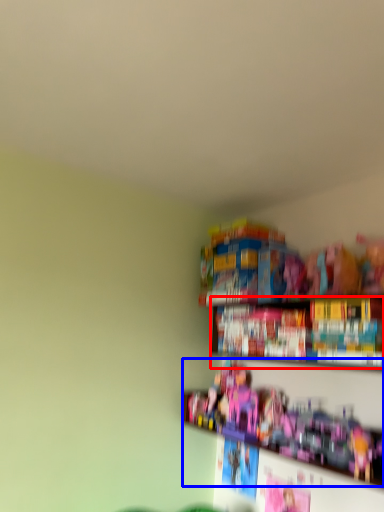
Question: Which point is further to the camera, book (highlighted by a red box) or toy (highlighted by a blue box)?

Choices:
 (A) book
 (B) toy

Answer: (A)